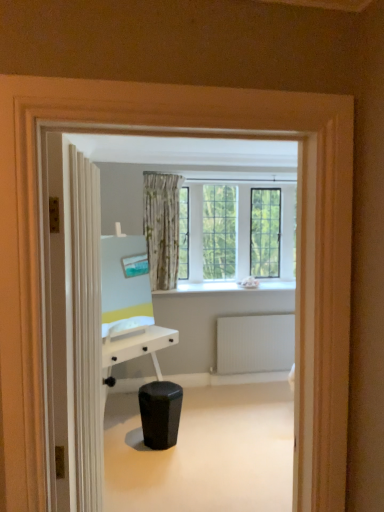
Find the location of a particular element. The width and height of the screenshot is (384, 512). free space in front of white matte radiator at lower right is located at coordinates (260, 396).